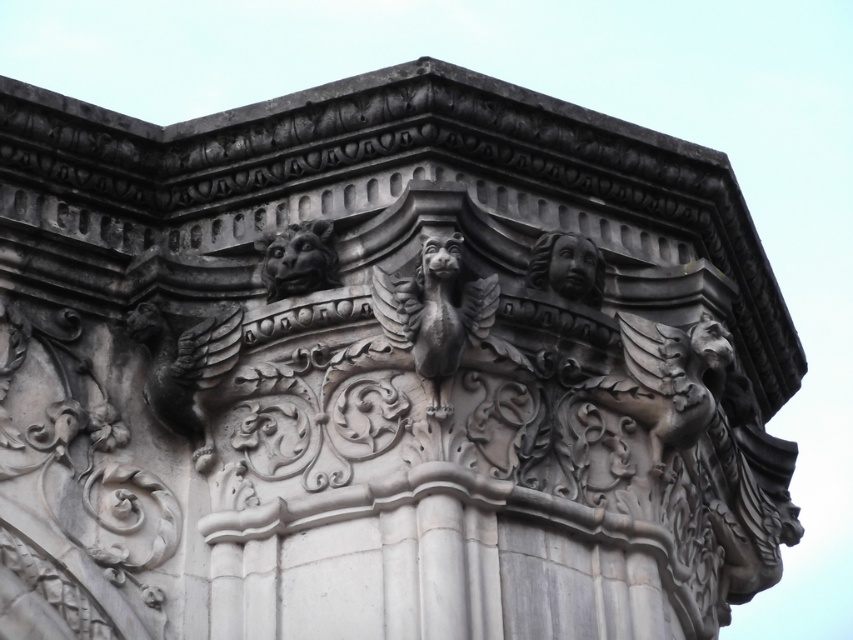
Who is taller, dark gray stone gargoyle at center or matte stone lion at upper center?

dark gray stone gargoyle at center is taller.

Can you confirm if dark gray stone gargoyle at center is smaller than matte stone lion at upper center?

No.

In the scene shown: Who is more distant from viewer, (445, 349) or (270, 262)?

Positioned behind is point (270, 262).

Find the location of `dark gray stone gargoyle at center`. dark gray stone gargoyle at center is located at coordinates (434, 314).

Does matte stone lion at upper center appear on the right side of polished stone face at upper right?

In fact, matte stone lion at upper center is to the left of polished stone face at upper right.

Is matte stone lion at upper center positioned behind polished stone face at upper right?

No, matte stone lion at upper center is closer to the viewer.

Is point (317, 262) positioned before point (590, 300)?

That is True.

The height and width of the screenshot is (640, 853). Identify the location of matte stone lion at upper center. (299, 259).

Between dark gray stone gargoyle at center and polished stone face at upper right, which one is positioned lower?

dark gray stone gargoyle at center

In order to click on dark gray stone gargoyle at center in this screenshot , I will do `click(434, 314)`.

The image size is (853, 640). Find the location of `dark gray stone gargoyle at center`. dark gray stone gargoyle at center is located at coordinates (434, 314).

Locate an element on the screen. The image size is (853, 640). dark gray stone gargoyle at center is located at coordinates (434, 314).